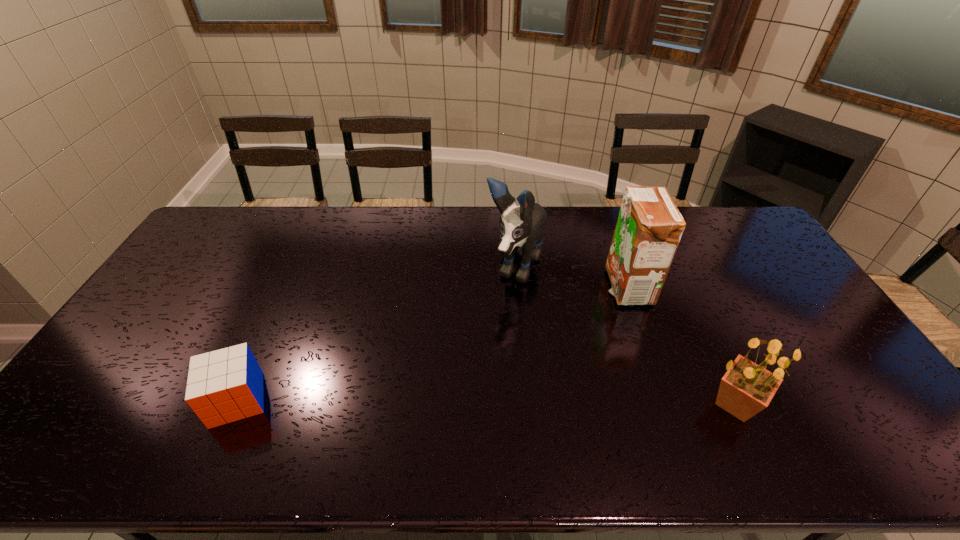
At what (x,y) coordinates should I click in order to perform the action: click on free location located on the straw side of the third object from left to right. Please return your answer as a coordinate pair (x, y). The image size is (960, 540). Looking at the image, I should click on (604, 310).

Locate an element on the screen. The width and height of the screenshot is (960, 540). free space located on the straw side of the third object from left to right is located at coordinates (528, 370).

Identify the location of vacant space located on the straw side of the third object from left to right. The image size is (960, 540). (604, 310).

Find the location of a particular element. free space located 0.230m on the front-facing side of the puppy is located at coordinates (473, 353).

Where is `free space located 0.100m on the front-facing side of the puppy`? free space located 0.100m on the front-facing side of the puppy is located at coordinates (492, 321).

You are a GUI agent. You are given a task and a screenshot of the screen. Output one action in this format:
    pyautogui.click(x=<x>, y=<y>)
    Task: Click on the free space located on the front-facing side of the puppy
    
    Given the screenshot: What is the action you would take?
    pyautogui.click(x=498, y=310)

This screenshot has width=960, height=540. I want to click on object that is at the far edge, so click(521, 228).

At what (x,y) coordinates should I click in order to perform the action: click on cube that is at the near edge. Please return your answer as a coordinate pair (x, y). Looking at the image, I should click on (226, 385).

The image size is (960, 540). I want to click on sunflower positioned at the near edge, so click(x=747, y=388).

Image resolution: width=960 pixels, height=540 pixels. What are the coordinates of `blank space at the far edge of the desktop` in the screenshot? It's located at (473, 225).